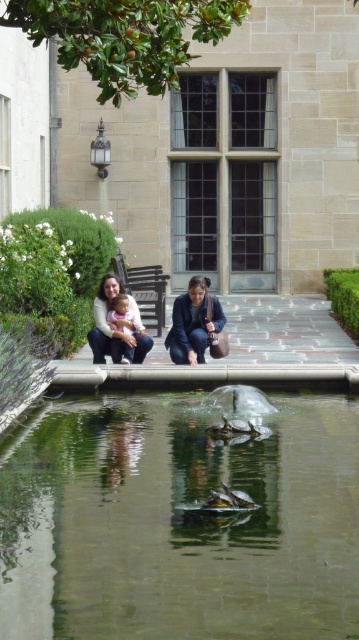
You are a photographer wanting to capture a photo of the matte blue jacket at center and the matte black jacket at lower center. Based on their heights, which jacket should you focus on first if you want to ensure both are in frame without moving the camera?

The matte blue jacket at center is not as tall as the matte black jacket at lower center, so you should focus on the matte black jacket at lower center first to ensure both are in frame.

You are a photographer standing in front of the large, elegant building with a prominent window. You notice the matte blue jacket at center and the pink fabric baby at center. Which object is positioned to the right of the other?

The matte blue jacket at center is to the right of the pink fabric baby at center.